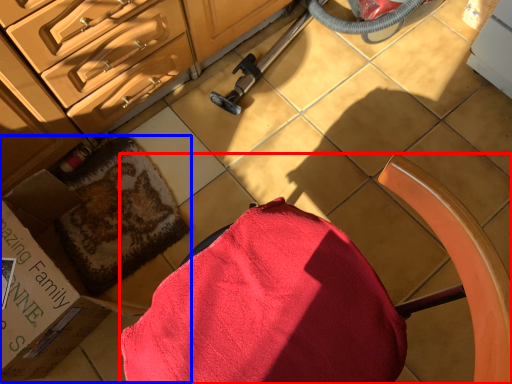
Question: Which object appears farthest to the camera in this image, chair (highlighted by a red box) or box (highlighted by a blue box)?

Choices:
 (A) chair
 (B) box

Answer: (B)